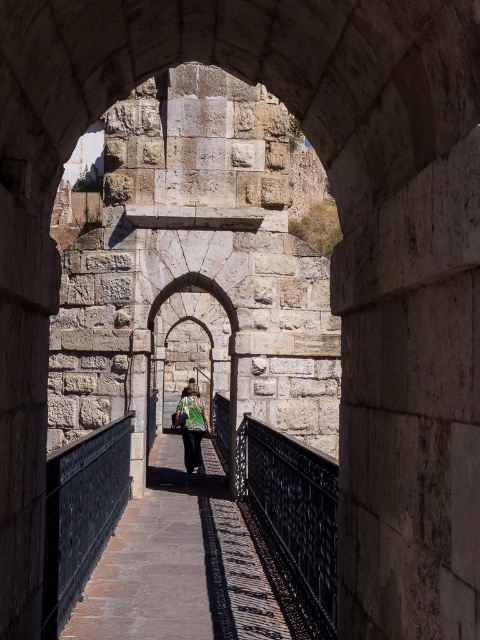
You are a tour guide leading a group through an ancient stone passageway. You notice a black wrought iron railing at center and a green fabric backpack at center. Which object is shorter in height?

The black wrought iron railing at center is shorter in height compared to the green fabric backpack at center.

You are standing at the entrance of the narrow stone passageway. There is a brown stone path at center marked by point (184, 564). If you walk straight ahead, will you stay on the brown stone path at center?

The brown stone path at center is represented by point (184, 564), so yes, walking straight ahead will keep you on the brown stone path at center.